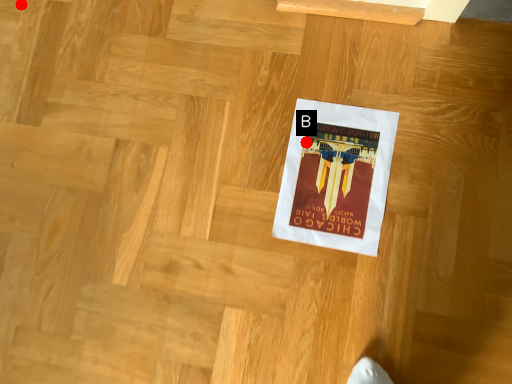
Question: Two points are circled on the image, labeled by A and B beside each circle. Which of the following is the closest to the observer?

Choices:
 (A) A is closer
 (B) B is closer

Answer: (B)